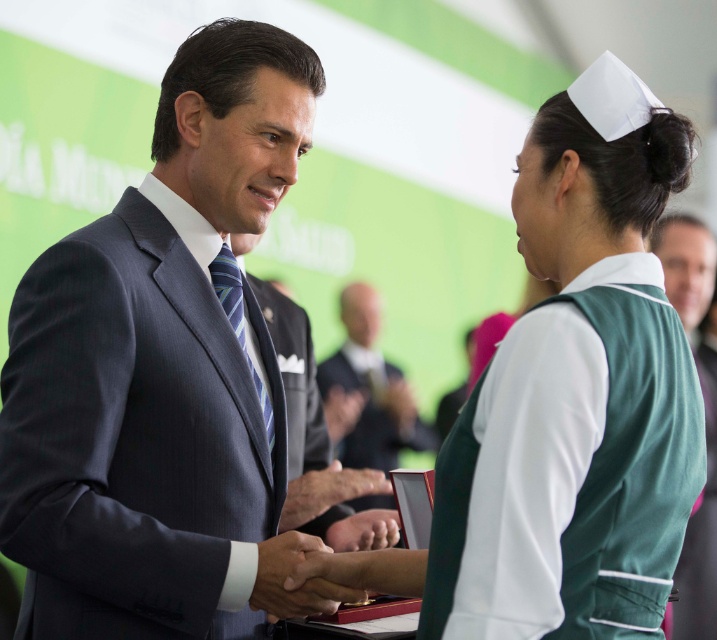
You are standing at the center of the image and want to locate the dark gray suit at center. In which direction should you look to find it?

You should look directly ahead because the dark gray suit at center is located at the center of the image, specifically at point coordinates [158,368].

You are a photographer at the event and need to position a camera on a tripod so that both the dark gray suit at center and the matte black suit at center are in frame. Given that the camera has a standard 50mm lens, which typically has a field of view that can capture subjects within a 46 degree angle, can you fit both individuals into the shot without moving the tripod?

The dark gray suit at center is much taller than the matte black suit at center. Since the camera lens has a fixed 46 degree field of view, the height difference between the two subjects may require adjusting the camera angle or zoom to ensure both are fully visible within the frame. However, without moving the tripod, it is possible to include both by centering the frame between them and using the lens appropriately.